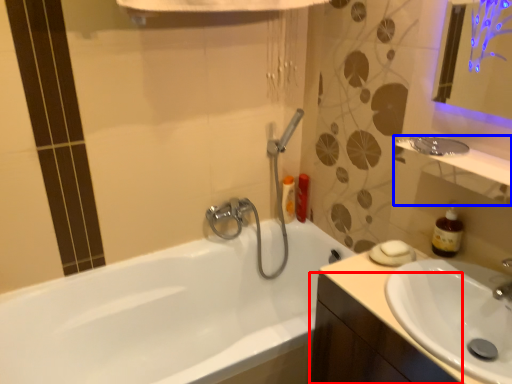
Question: Which object appears closest to the camera in this image, cabinetry (highlighted by a red box) or balustrade (highlighted by a blue box)?

Choices:
 (A) cabinetry
 (B) balustrade

Answer: (A)